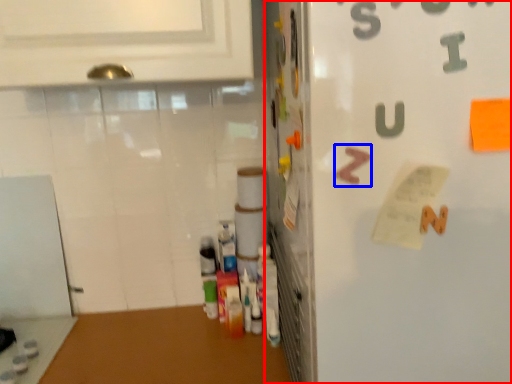
Question: Which of the following is the farthest to the observer, refrigerator (highlighted by a red box) or alphabet (highlighted by a blue box)?

Choices:
 (A) refrigerator
 (B) alphabet

Answer: (B)